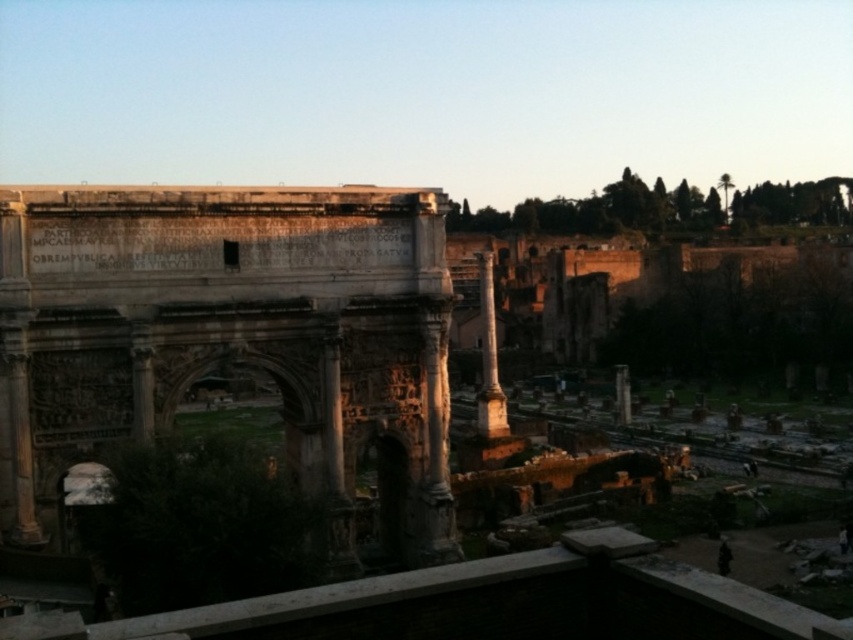
Does gray stone arch at center appear under smooth stone pillar at center?

Actually, gray stone arch at center is above smooth stone pillar at center.

Which is below, gray stone arch at center or smooth stone pillar at center?

Positioned lower is smooth stone pillar at center.

Is point (194, 259) positioned behind point (619, 422)?

No, (194, 259) is in front of (619, 422).

This screenshot has height=640, width=853. I want to click on gray stone arch at center, so click(x=231, y=337).

Is point (431, 193) positioned after point (486, 385)?

No, it is not.

This screenshot has height=640, width=853. What do you see at coordinates (231, 337) in the screenshot?
I see `gray stone arch at center` at bounding box center [231, 337].

Where is `gray stone arch at center`? Image resolution: width=853 pixels, height=640 pixels. gray stone arch at center is located at coordinates (231, 337).

Is the position of white marble column at center less distant than that of smooth stone pillar at center?

Yes, white marble column at center is closer to the viewer.

What do you see at coordinates (489, 358) in the screenshot? The image size is (853, 640). I see `white marble column at center` at bounding box center [489, 358].

I want to click on white marble column at center, so click(489, 358).